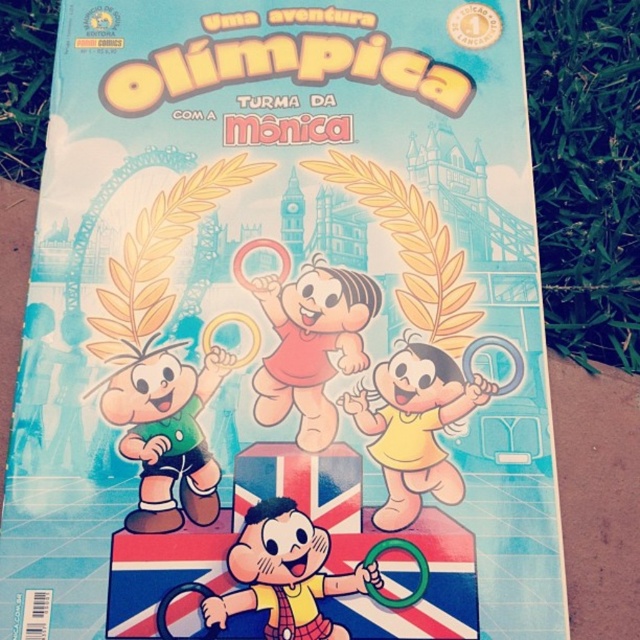
You are an art student analyzing the comic book cover. You notice two green elements on the cover. The first is the green matte shorts at lower left, and the second is the green grass at upper left. Which of these two elements appears smaller in size on the cover?

The green matte shorts at lower left is smaller than the green grass at upper left.

You are a character in the comic book cover and want to know if your green matte shorts at lower left are visible over the green grass at upper left. Can you confirm this?

The green matte shorts at lower left is in front of green grass at upper left, so yes, the shorts are visible over the grass.